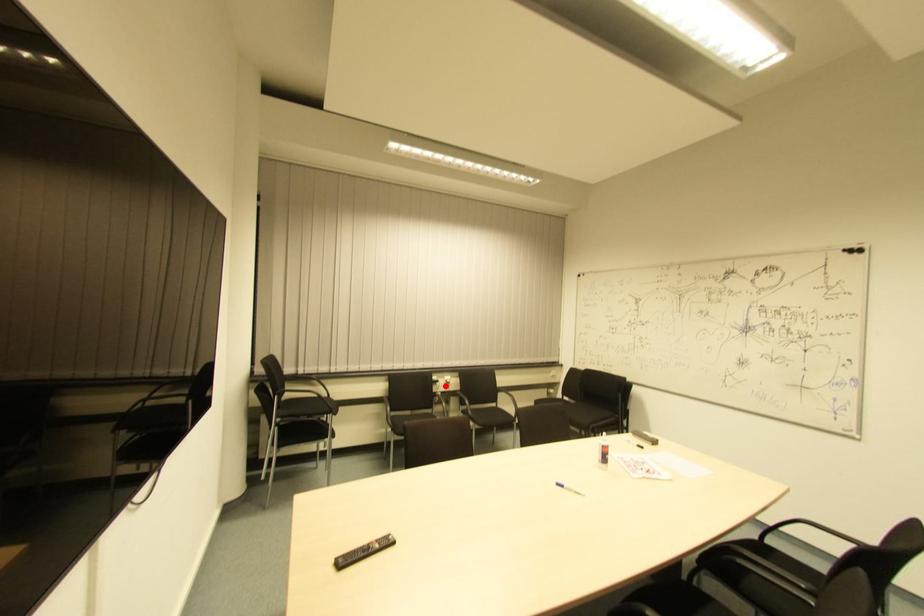
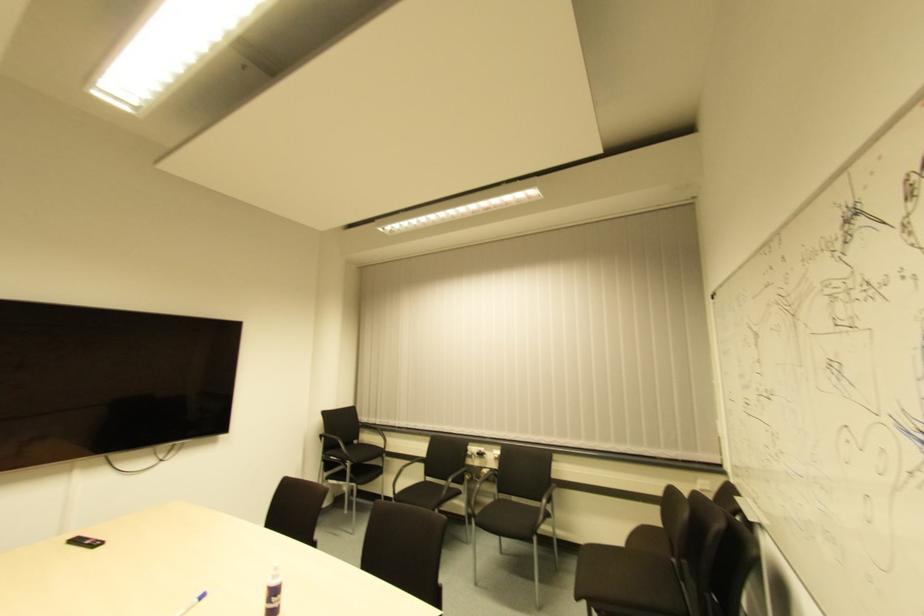
The point at the highlighted location is marked in the first image. Where is the corresponding point in the second image?

(494, 462)